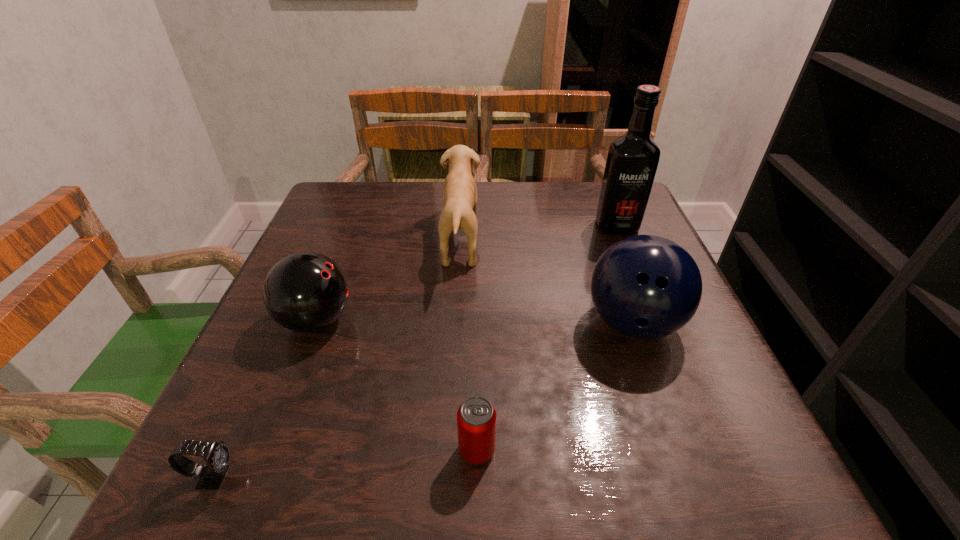
The width and height of the screenshot is (960, 540). I want to click on bowling ball situated at the right edge, so click(x=646, y=287).

Find the location of a particular element. The height and width of the screenshot is (540, 960). object that is positioned at the near left corner is located at coordinates [x=217, y=456].

This screenshot has width=960, height=540. I want to click on object at the far right corner, so click(632, 160).

Locate an element on the screen. The height and width of the screenshot is (540, 960). free point at the far edge is located at coordinates (427, 206).

In the image, there is a desktop. Identify the location of free space at the near edge. The width and height of the screenshot is (960, 540). (593, 476).

The width and height of the screenshot is (960, 540). I want to click on free space at the left edge, so click(x=266, y=313).

This screenshot has height=540, width=960. I want to click on free spot at the right edge of the desktop, so click(x=696, y=312).

In the image, there is a desktop. At what (x,y) coordinates should I click in order to perform the action: click on free space at the far left corner. Please return your answer as a coordinate pair (x, y). Image resolution: width=960 pixels, height=540 pixels. Looking at the image, I should click on (341, 188).

Locate an element on the screen. The image size is (960, 540). free region at the near left corner of the desktop is located at coordinates (245, 452).

Image resolution: width=960 pixels, height=540 pixels. Identify the location of vacant space at the far right corner. (594, 219).